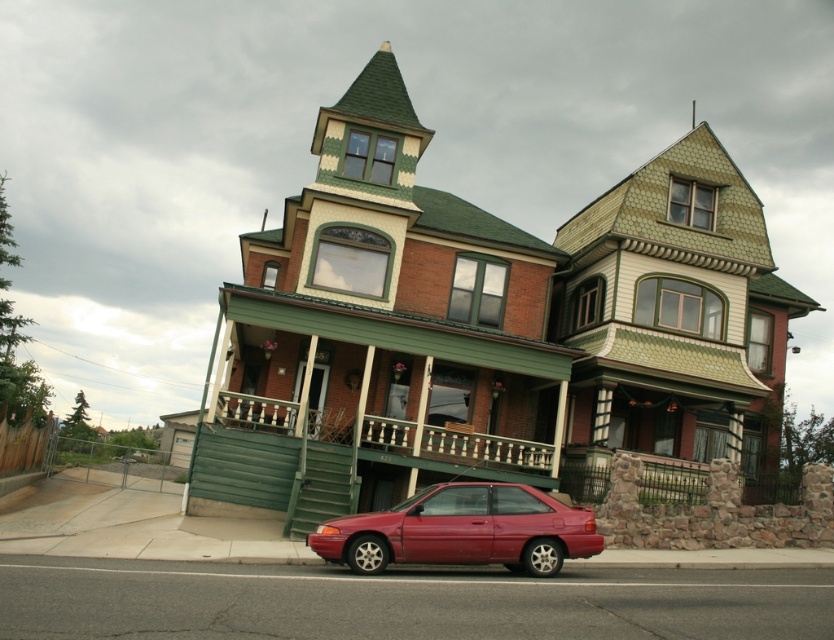
Question: Is shiny red car at lower center behind green painted wood porch at center?

Choices:
 (A) no
 (B) yes

Answer: (A)

Question: Among these points, which one is nearest to the camera?

Choices:
 (A) (529, 468)
 (B) (470, 561)

Answer: (B)

Question: Is shiny red car at lower center above green painted wood porch at center?

Choices:
 (A) no
 (B) yes

Answer: (A)

Question: Among these objects, which one is farthest from the camera?

Choices:
 (A) green painted wood porch at center
 (B) shiny red car at lower center

Answer: (A)

Question: Does shiny red car at lower center lie behind green painted wood porch at center?

Choices:
 (A) no
 (B) yes

Answer: (A)